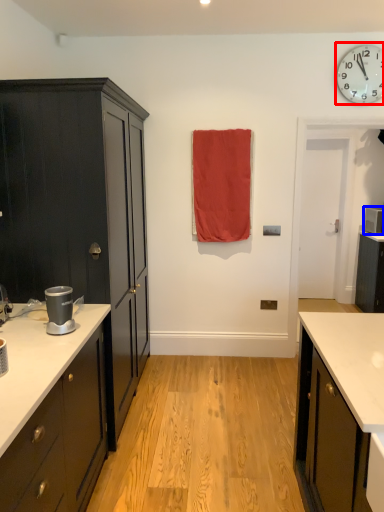
Question: Which of the following is the farthest to the observer, wall clock (highlighted by a red box) or appliance (highlighted by a blue box)?

Choices:
 (A) wall clock
 (B) appliance

Answer: (B)